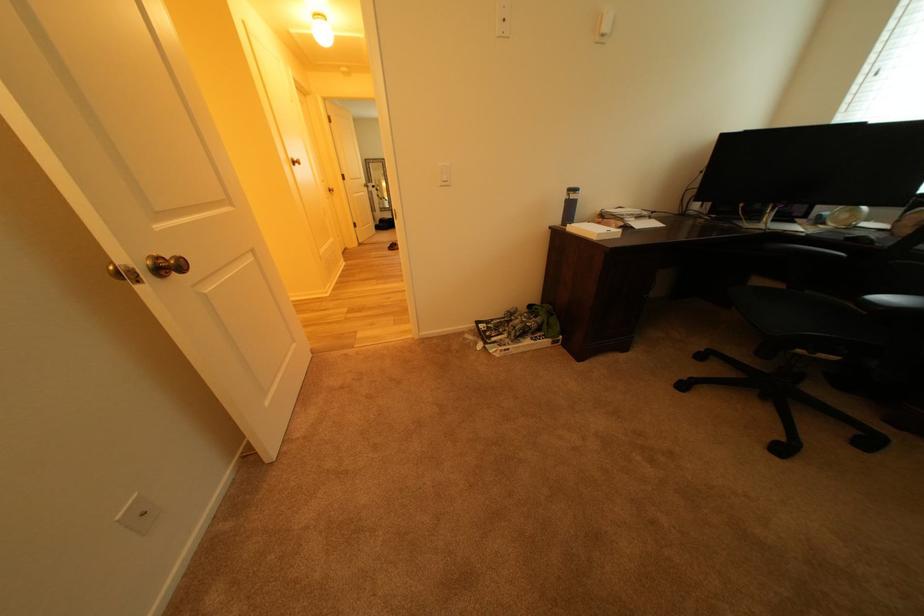
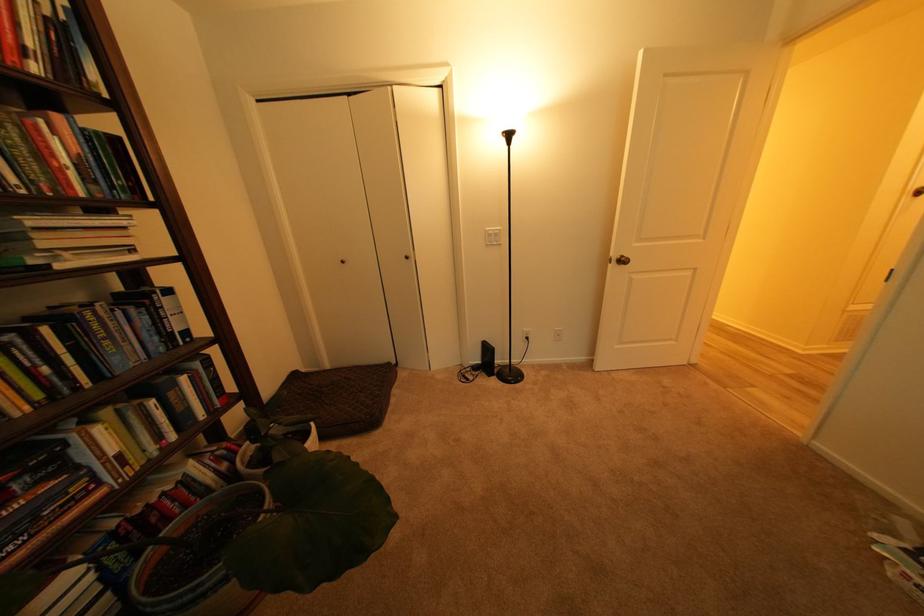
Where in the second image is the point corresponding to (149,283) from the first image?

(621, 265)